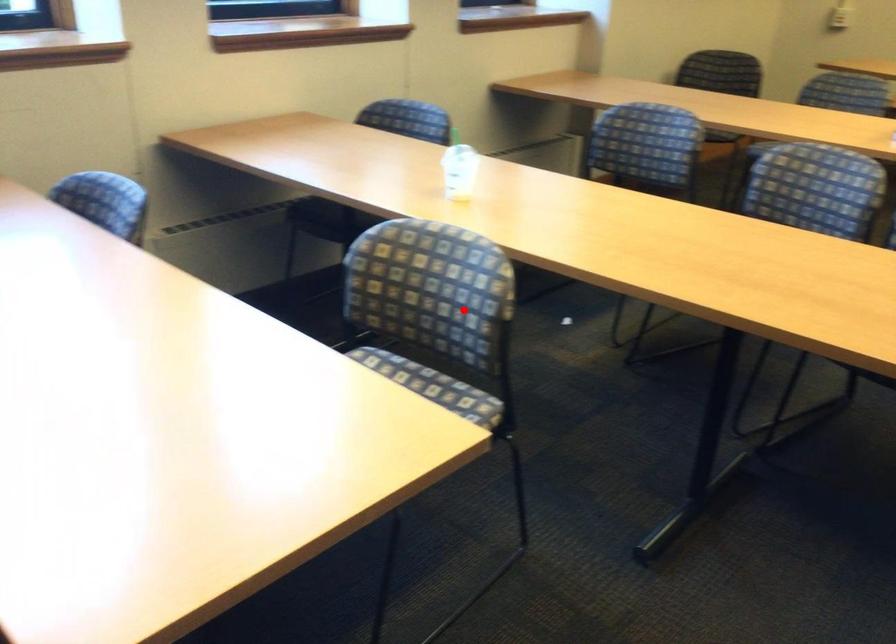
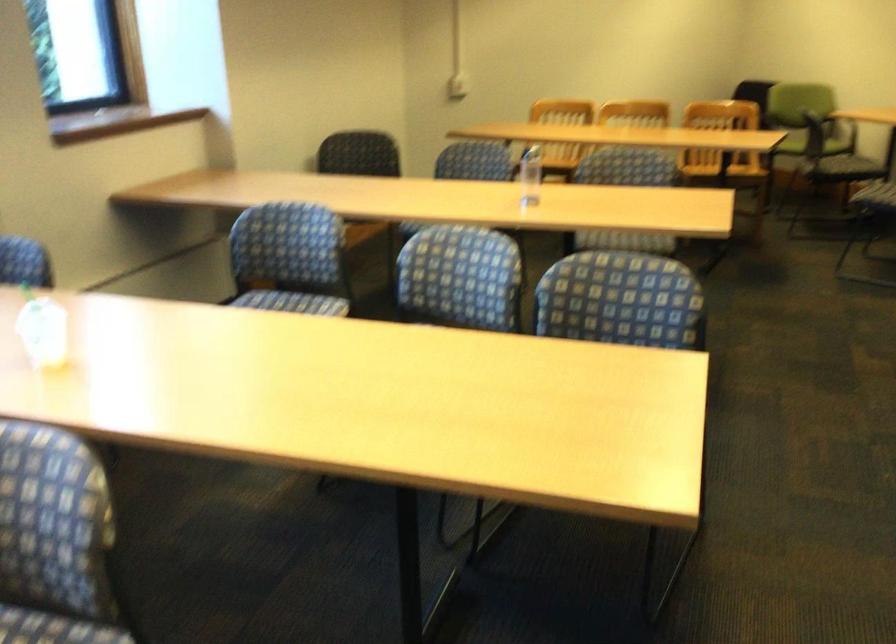
Question: I am providing you with two images of the same scene from different viewpoints. Given a red point in image1, look at the same physical point in image2. Is it:

Choices:
 (A) Closer to the viewpoint
 (B) Farther from the viewpoint

Answer: (A)